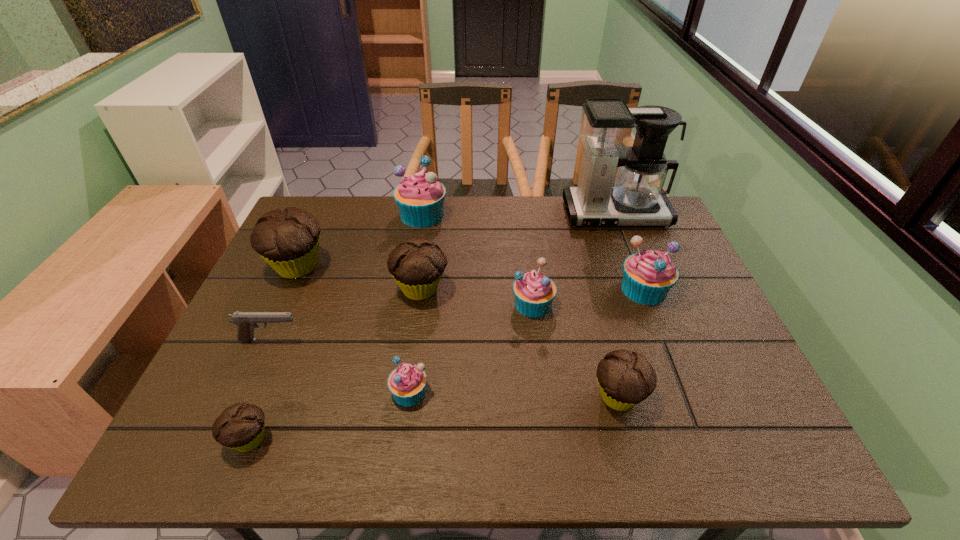
Where is `the rightmost chocolate muffin`? the rightmost chocolate muffin is located at coordinates (625, 379).

Locate an element on the screen. The width and height of the screenshot is (960, 540). the second smallest chocolate muffin is located at coordinates (625, 379).

In order to click on the seventh farthest object in this screenshot , I will do `click(246, 321)`.

The width and height of the screenshot is (960, 540). Identify the location of the smallest blue muffin. (407, 383).

Locate an element on the screen. The image size is (960, 540). the smallest chocolate muffin is located at coordinates (240, 427).

You are a GUI agent. You are given a task and a screenshot of the screen. Output one action in this format:
    pyautogui.click(x=<x>, y=<y>)
    Task: Click on the vacant region located at the front of the coffee maker where the controls are located
    This screenshot has width=960, height=540.
    Given the screenshot: What is the action you would take?
    pyautogui.click(x=630, y=253)

The height and width of the screenshot is (540, 960). What are the coordinates of `free space located on the front of the farthest muffin` in the screenshot? It's located at (403, 328).

You are a GUI agent. You are given a task and a screenshot of the screen. Output one action in this format:
    pyautogui.click(x=<x>, y=<y>)
    Task: Click on the blank area located 0.190m on the back of the biggest chocolate muffin
    The height and width of the screenshot is (540, 960).
    Given the screenshot: What is the action you would take?
    pyautogui.click(x=324, y=210)

Locate an element on the screen. vacant area situated 0.240m on the left of the rightmost muffin is located at coordinates (528, 289).

Locate an element on the screen. The image size is (960, 540). vacant space located on the right of the third chocolate muffin from left to right is located at coordinates (595, 289).